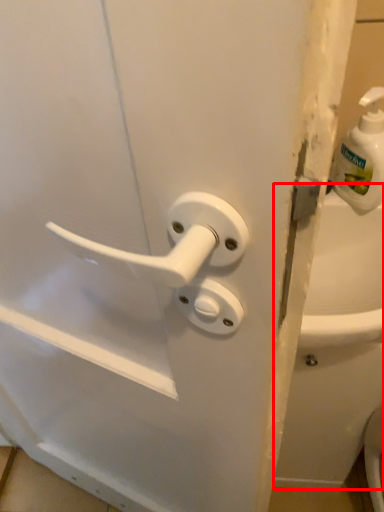
Question: From the image's perspective, where is bath (annotated by the red box) located in relation to soap dispenser in the image?

Choices:
 (A) above
 (B) below

Answer: (B)